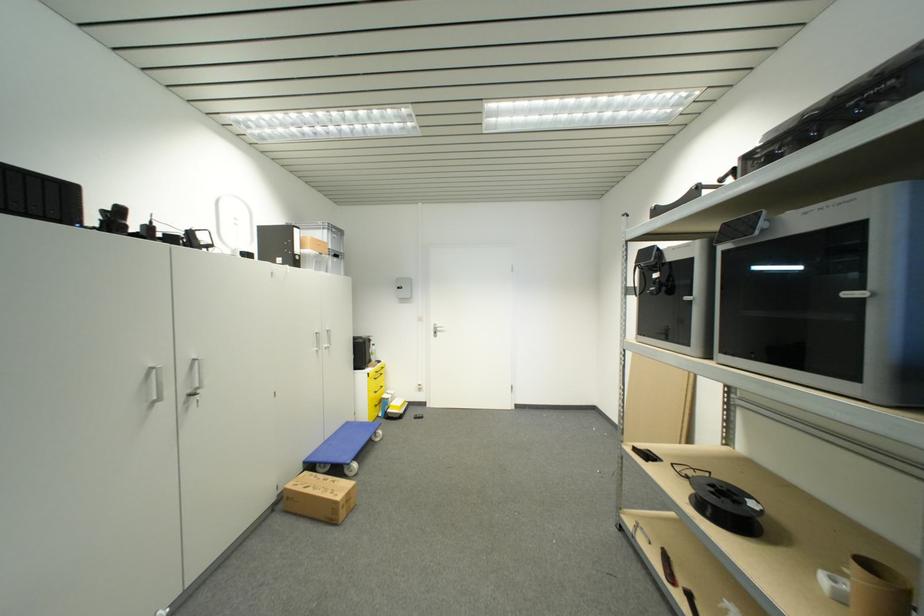
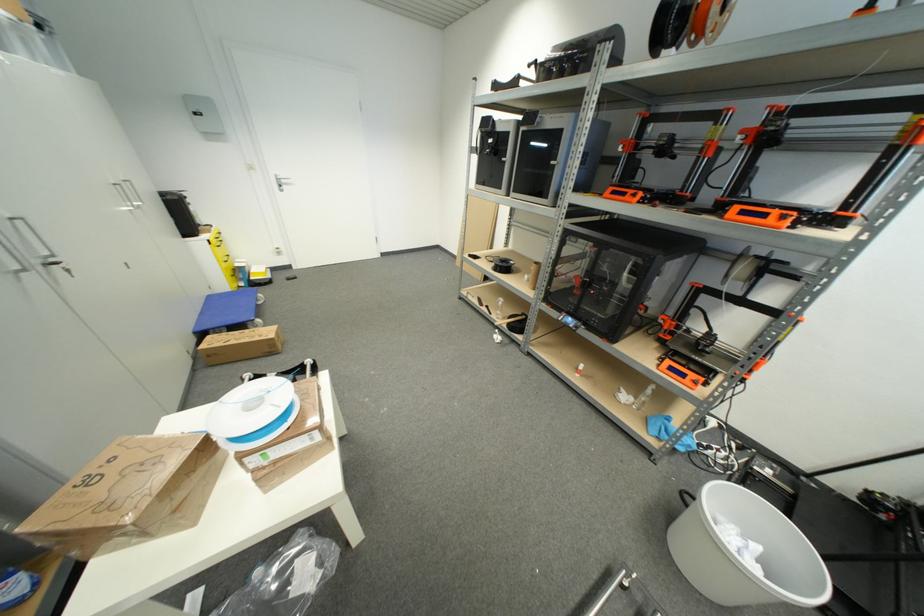
The point at [310,476] is marked in the first image. Where is the corresponding point in the second image?

(213, 339)